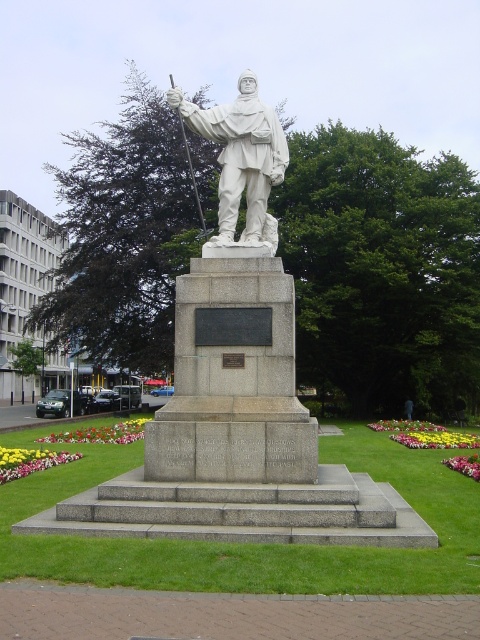
In the scene shown: Between gray stone steps at center and white marble statue at center, which one appears on the right side from the viewer's perspective?

gray stone steps at center

Between gray stone steps at center and white marble statue at center, which one has less height?

gray stone steps at center

Between point (468, 515) and point (251, 164), which one is positioned behind?

The point (251, 164) is behind.

Image resolution: width=480 pixels, height=640 pixels. Find the location of `gray stone steps at center`. gray stone steps at center is located at coordinates (256, 545).